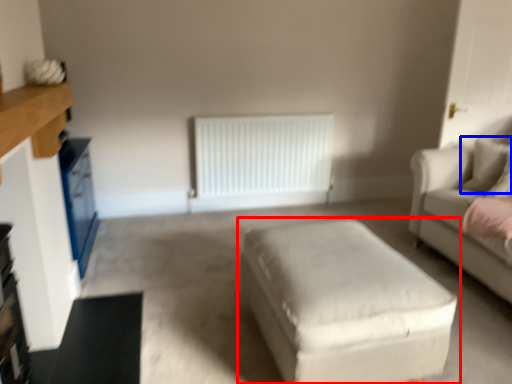
Question: Which point is further to the camera, table (highlighted by a red box) or pillow (highlighted by a blue box)?

Choices:
 (A) table
 (B) pillow

Answer: (B)